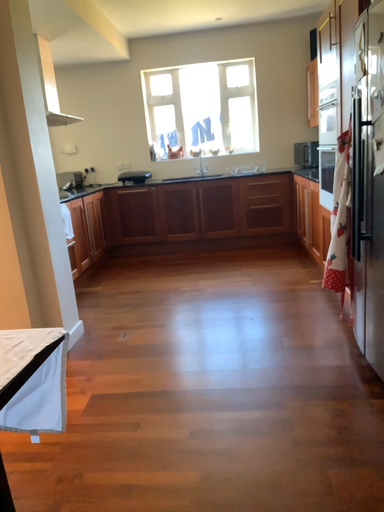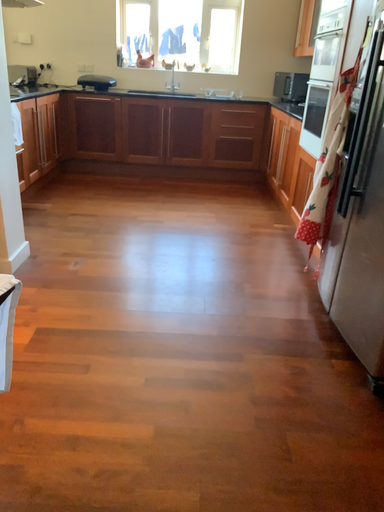
Question: Which way did the camera rotate in the video?

Choices:
 (A) rotated upward
 (B) rotated downward

Answer: (B)